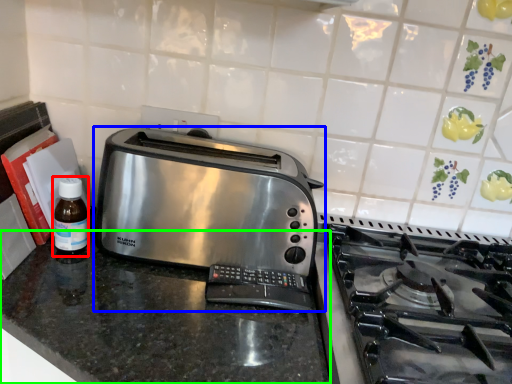
Question: Based on their relative distances, which object is farther from bottle (highlighted by a red box)? Choose from toaster (highlighted by a blue box) and counter (highlighted by a green box).

Choices:
 (A) toaster
 (B) counter

Answer: (A)